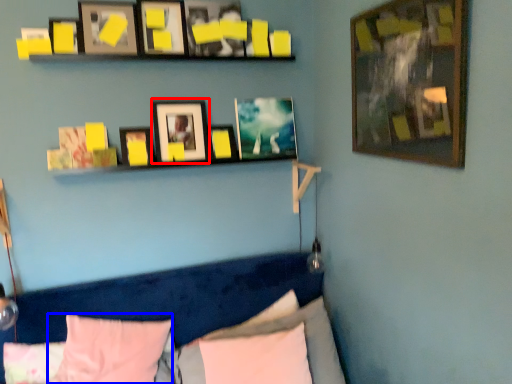
Question: Which of the following is the closest to the observer, picture frame (highlighted by a red box) or pillow (highlighted by a blue box)?

Choices:
 (A) picture frame
 (B) pillow

Answer: (B)